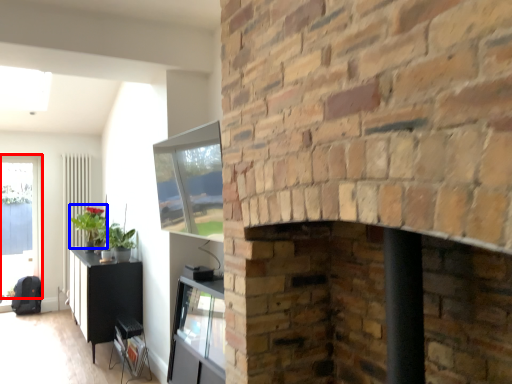
Question: Which of the following is the closest to the observer, window (highlighted by a red box) or plant (highlighted by a blue box)?

Choices:
 (A) window
 (B) plant

Answer: (B)